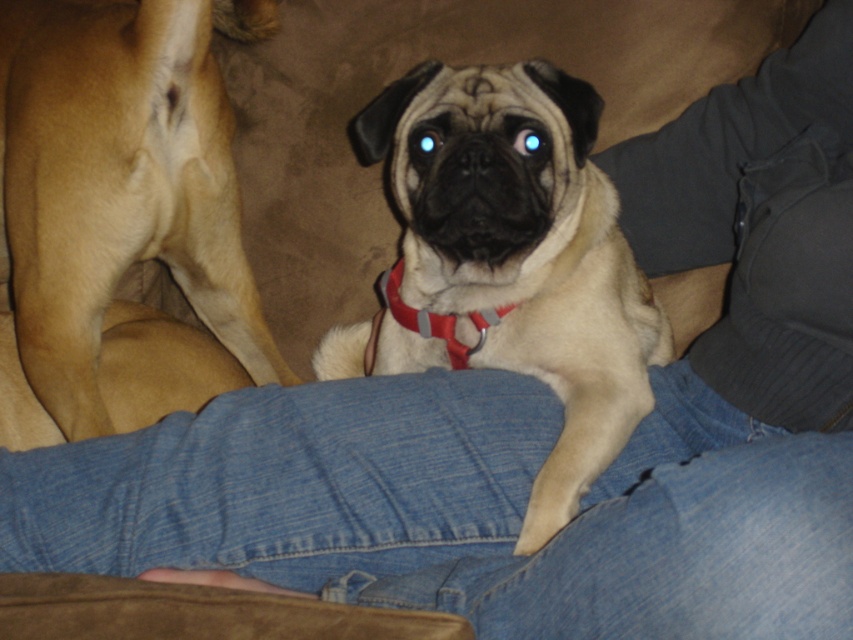
Who is lower down, furry beige dog at center or red nylon collar at center?

furry beige dog at center is lower down.

Is furry beige dog at center above red nylon collar at center?

No.

Describe the element at coordinates (509, 260) in the screenshot. I see `furry beige dog at center` at that location.

I want to click on furry beige dog at center, so click(509, 260).

Consider the image. Who is taller, furry beige dog at center or light brown fur at left?

Standing taller between the two is light brown fur at left.

Is furry beige dog at center positioned before light brown fur at left?

Yes, furry beige dog at center is in front of light brown fur at left.

Does point (503, 282) come farther from viewer compared to point (25, 49)?

No, (503, 282) is closer to viewer.

Identify the location of furry beige dog at center. (509, 260).

What do you see at coordinates (120, 180) in the screenshot?
I see `light brown fur at left` at bounding box center [120, 180].

Who is more distant from viewer, [258,3] or [421,321]?

Positioned behind is point [258,3].

Where is `light brown fur at left`? This screenshot has height=640, width=853. light brown fur at left is located at coordinates (120, 180).